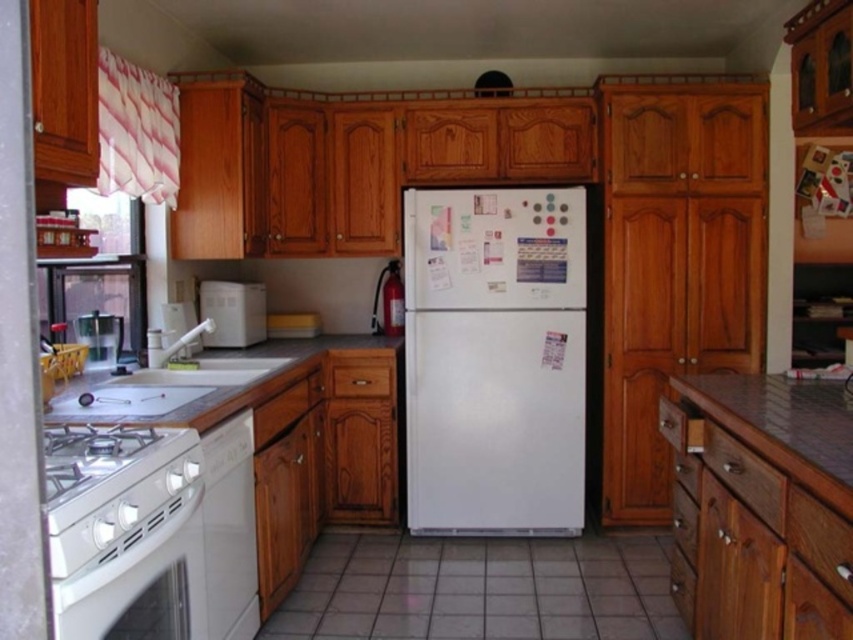
You are a chef preparing to place a tall soup pot on the metallic silver counter top at lower right and the white matte microwave at center. Which surface can accommodate the pot without it exceeding the height of the microwave?

The white matte microwave at center is taller than the metallic silver counter top at lower right, so placing the tall soup pot on the white matte microwave at center would ensure it doesn

You are moving a 4 feet wide box through the kitchen. You need to place it between the white matte refrigerator at center and the metallic silver counter top at lower right. Is there enough space for the box to fit between them?

The white matte refrigerator at center is 3.99 feet away from the metallic silver counter top at lower right. Since the box is 4 feet wide, there isn not enough space for the box to fit between them.